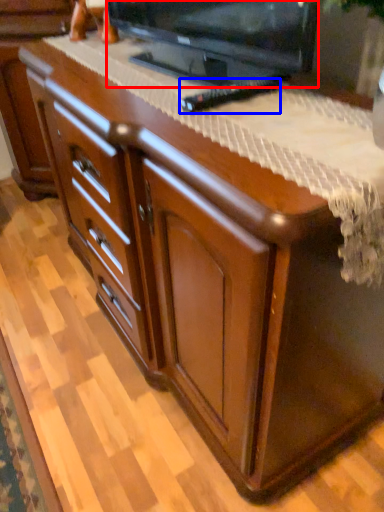
Question: Which point is further to the camera, television (highlighted by a red box) or remote (highlighted by a blue box)?

Choices:
 (A) television
 (B) remote

Answer: (B)